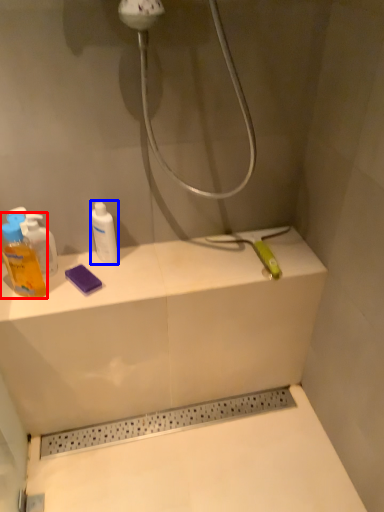
Question: Which of the following is the farthest to the observer, mouthwash (highlighted by a red box) or mouthwash (highlighted by a blue box)?

Choices:
 (A) mouthwash
 (B) mouthwash

Answer: (B)